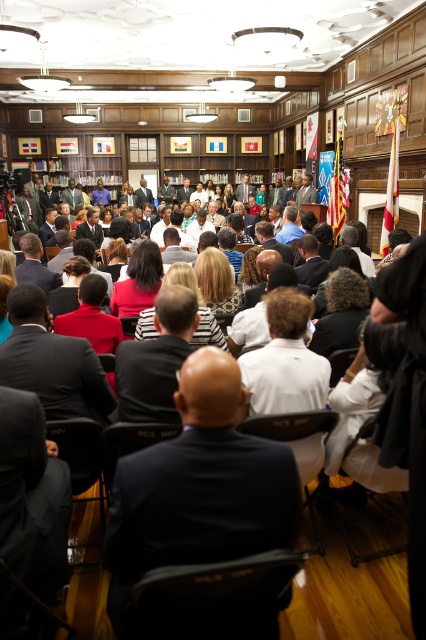
You are standing in the room and want to place a 4.5 feet tall decorative plant at point (190, 467). Considering the ceiling height, will it fit without touching the ceiling?

The point (190, 467) is 4.33 feet away from the viewer. The decorative plant is 4.5 feet tall, so it will be 0.17 feet taller than the available space, meaning it will touch the ceiling.

You are a photographer at the event and want to capture both the matte red dress at center and the matte black jacket at center in a single frame. Considering their sizes, which one should you focus on to ensure both are clearly visible?

Since the matte red dress at center is smaller than the matte black jacket at center, you should focus on the matte red dress at center to ensure both are clearly visible in the frame.

You are an event organizer and need to seat two guests in a row of chairs. The guests are wearing a matte red dress at center and a matte black jacket at center. Which guest should you seat in the narrower chair to ensure a proper fit?

The matte red dress at center is thinner than the matte black jacket at center, so the guest wearing the matte red dress at center should be seated in the narrower chair to ensure a proper fit.